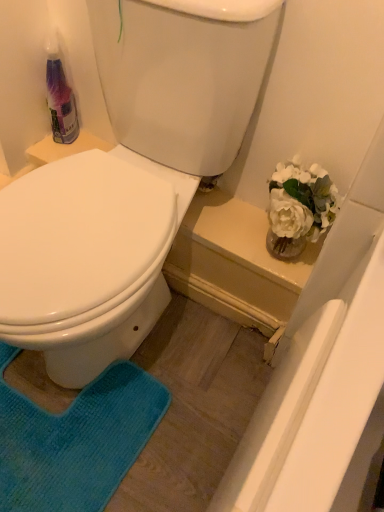
Locate an element on the screen. vacant area located to the right-hand side of blue textured rug at lower left is located at coordinates (188, 411).